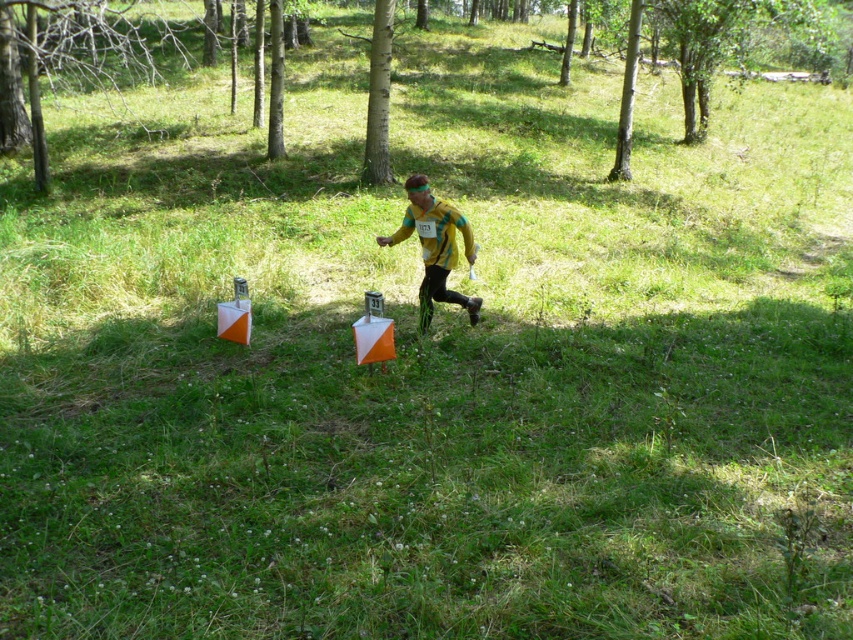
Question: Among these objects, which one is nearest to the camera?

Choices:
 (A) yellow-green fabric at center
 (B) smooth bark tree at center
 (C) green smooth tree at center

Answer: (A)

Question: Considering the real-world distances, which object is farthest from the green smooth tree at center?

Choices:
 (A) yellow-green fabric at center
 (B) smooth bark tree at upper right
 (C) smooth bark tree at center

Answer: (A)

Question: Does green smooth tree at center lie in front of smooth bark tree at upper right?

Choices:
 (A) yes
 (B) no

Answer: (A)

Question: Can you confirm if yellow-green fabric at center is smaller than smooth bark tree at center?

Choices:
 (A) yes
 (B) no

Answer: (A)

Question: Which object is positioned farthest from the green smooth tree at center?

Choices:
 (A) smooth bark tree at center
 (B) yellow-green fabric at center

Answer: (B)

Question: Can you confirm if yellow-green fabric at center is positioned to the right of smooth bark tree at upper right?

Choices:
 (A) yes
 (B) no

Answer: (B)